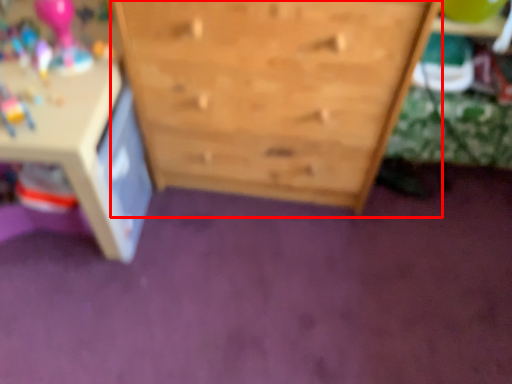
Question: From the image's perspective, where is chest of drawers (annotated by the red box) located in relation to table in the image?

Choices:
 (A) above
 (B) below

Answer: (A)